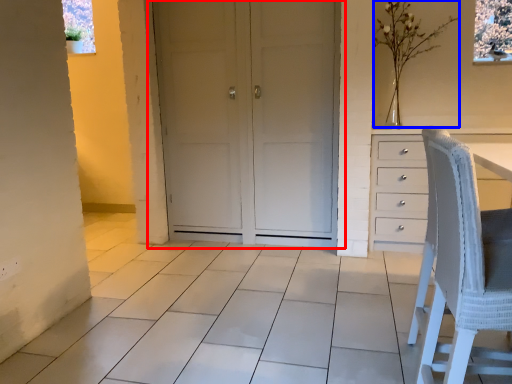
Question: Which point is further to the camera, door (highlighted by a red box) or flower (highlighted by a blue box)?

Choices:
 (A) door
 (B) flower

Answer: (B)